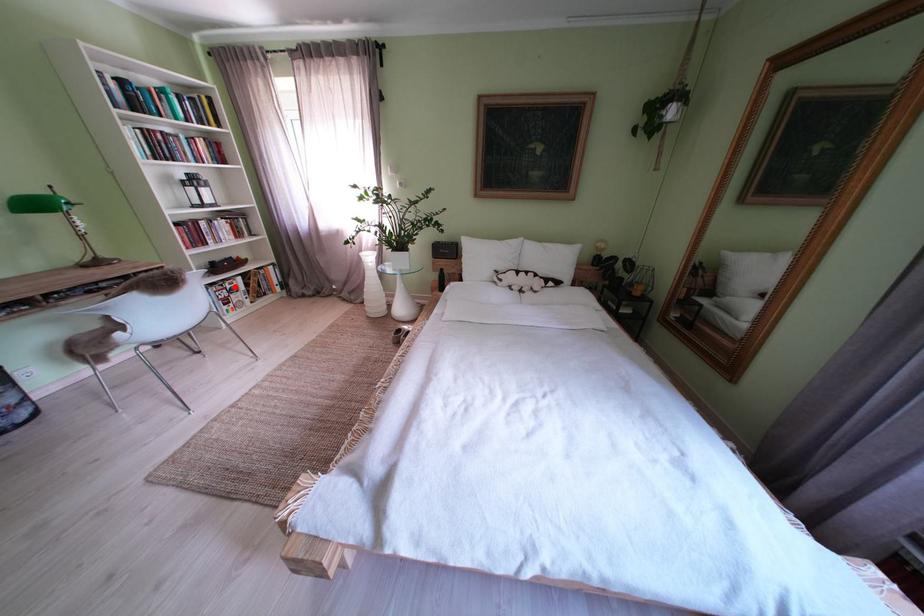
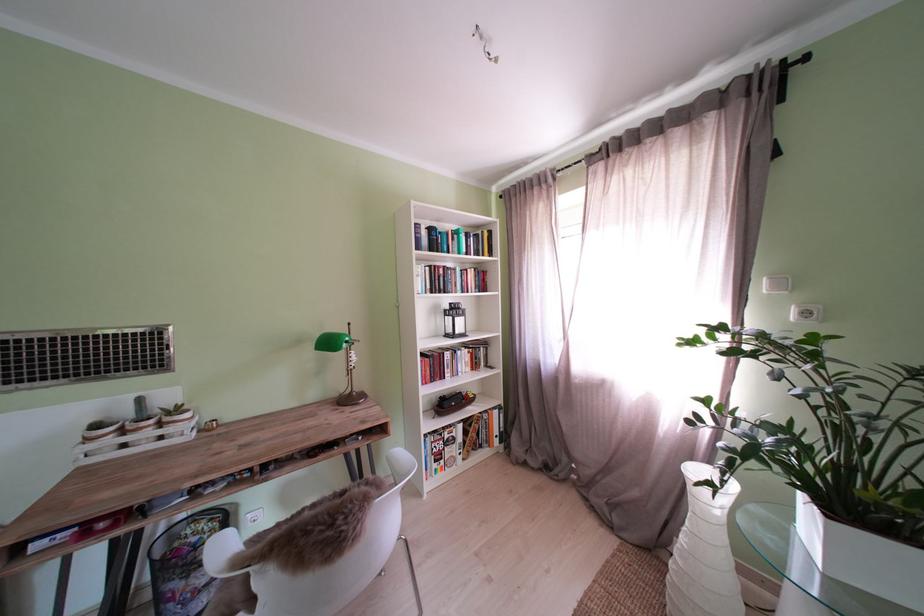
Question: I am providing you with two images of the same scene from different viewpoints. In image1, a red point is highlighted. Considering the same 3D point in image2, which of the following is correct?

Choices:
 (A) It is closer
 (B) It is farther

Answer: (B)